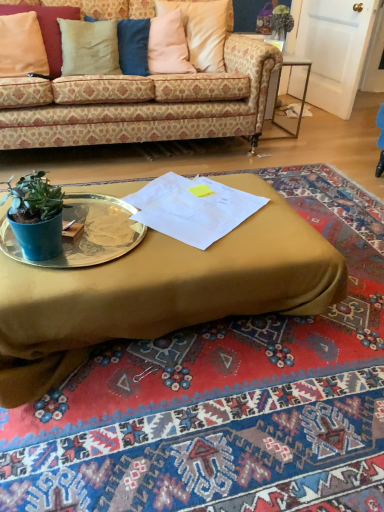
Where is `vacant area located to the right-hand side of metallic mirrored side table at right`? This screenshot has height=512, width=384. vacant area located to the right-hand side of metallic mirrored side table at right is located at coordinates (316, 134).